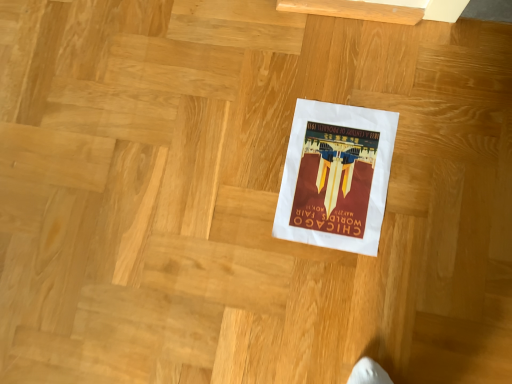
Locate an element on the screen. The width and height of the screenshot is (512, 384). empty space that is ontop of white paper poster at center (from a real-world perspective) is located at coordinates (339, 177).